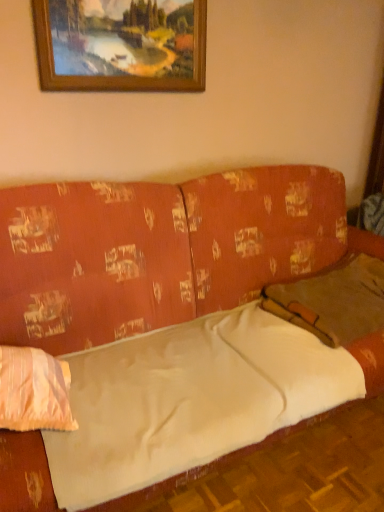
Where is `vacant region below wooden picture frame at upper center (from a real-world perspective)`? The width and height of the screenshot is (384, 512). vacant region below wooden picture frame at upper center (from a real-world perspective) is located at coordinates (117, 153).